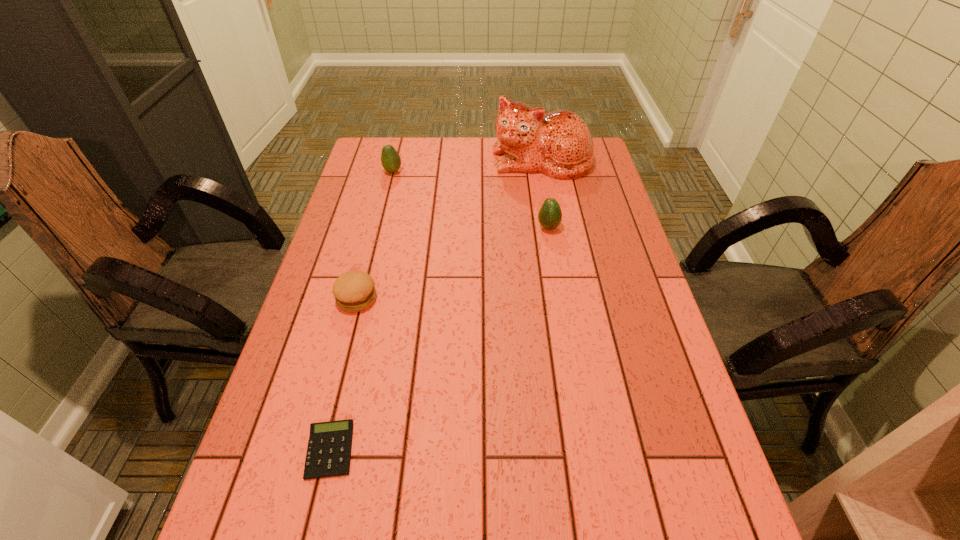
At what (x,y) coordinates should I click in order to perform the action: click on vacant space situated 0.330m on the left of the third farthest object. Please return your answer as a coordinate pair (x, y). The image size is (960, 540). Looking at the image, I should click on (429, 227).

In order to click on free spot located 0.260m on the front of the hamburger in this screenshot , I will do `click(328, 409)`.

Find the location of a particular element. The image size is (960, 540). vacant space situated on the back of the nearest object is located at coordinates click(366, 299).

You are a GUI agent. You are given a task and a screenshot of the screen. Output one action in this format:
    pyautogui.click(x=<x>, y=<y>)
    Task: Click on the cat at the far edge
    The width and height of the screenshot is (960, 540).
    Given the screenshot: What is the action you would take?
    pyautogui.click(x=559, y=144)

I want to click on avocado that is at the far edge, so click(390, 159).

Locate an element on the screen. This screenshot has height=540, width=960. avocado situated at the left edge is located at coordinates (390, 159).

What are the coordinates of `hamburger that is at the left edge` in the screenshot? It's located at (354, 291).

The image size is (960, 540). In order to click on calculator that is at the left edge in this screenshot , I will do `click(329, 448)`.

This screenshot has width=960, height=540. What are the coordinates of `object located in the right edge section of the desktop` in the screenshot? It's located at (559, 144).

The image size is (960, 540). Find the location of `object located at the far left corner`. object located at the far left corner is located at coordinates (390, 159).